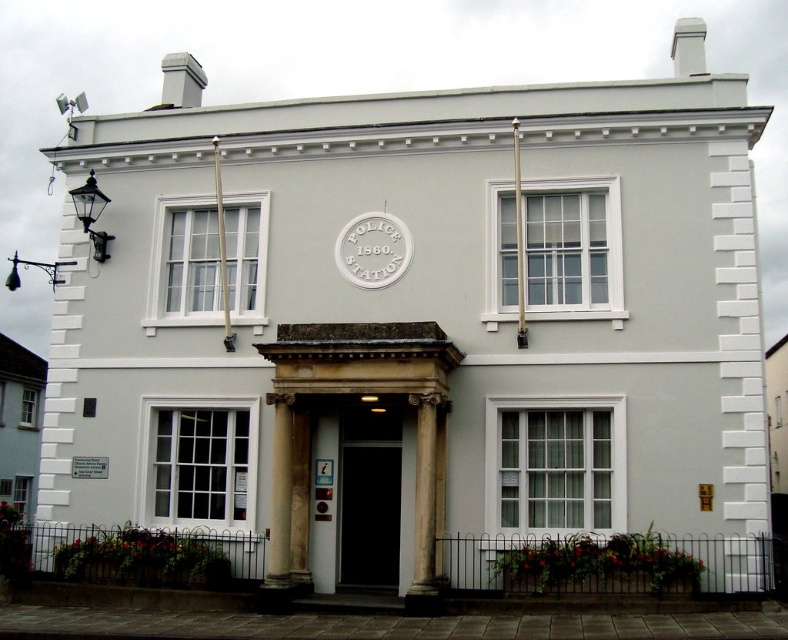
Question: Which of these objects is positioned closest to the white marble column at center?

Choices:
 (A) white marble pillar at center
 (B) white stone clock at center

Answer: (A)

Question: Does white stone clock at center appear on the left side of white marble pillar at center?

Choices:
 (A) yes
 (B) no

Answer: (B)

Question: Can you confirm if black glass door at center is positioned to the left of white marble column at center?

Choices:
 (A) yes
 (B) no

Answer: (A)

Question: Among these points, which one is nearest to the camera?

Choices:
 (A) (389, 429)
 (B) (348, 248)
 (C) (415, 413)
 (D) (277, 529)

Answer: (D)

Question: Estimate the real-world distances between objects in this image. Which object is farther from the white marble pillar at center?

Choices:
 (A) white stone clock at center
 (B) black glass door at center

Answer: (A)

Question: Does black glass door at center appear on the left side of white marble column at center?

Choices:
 (A) no
 (B) yes

Answer: (B)